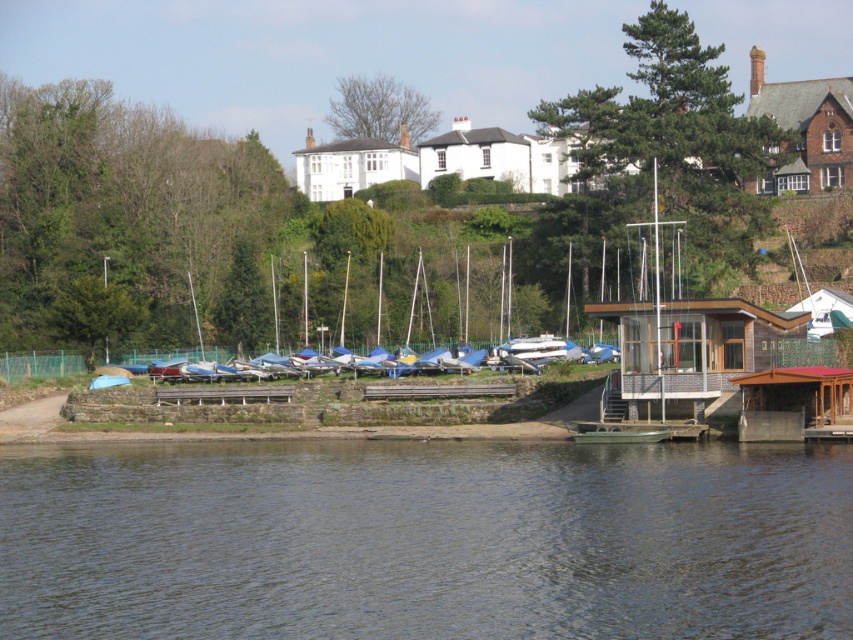
Can you confirm if green rubber boat at lower center is smaller than brown wooden dock at lower right?

Actually, green rubber boat at lower center might be larger than brown wooden dock at lower right.

Is green rubber boat at lower center wider than brown wooden dock at lower right?

Yes.

Identify the location of green rubber boat at lower center. (425, 540).

Find the location of a particular element. The height and width of the screenshot is (640, 853). green rubber boat at lower center is located at coordinates (425, 540).